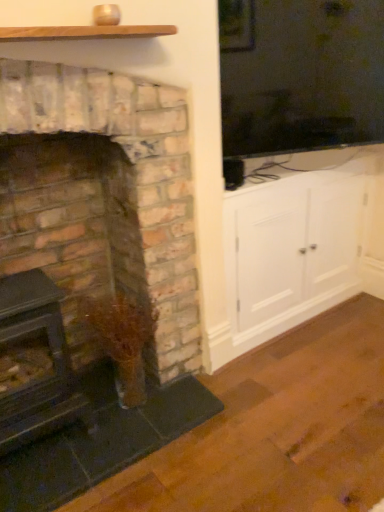
The image size is (384, 512). I want to click on free location to the right of rustic brick fireplace at left, positioned as the 2th fireplace in right-to-left order, so click(x=121, y=431).